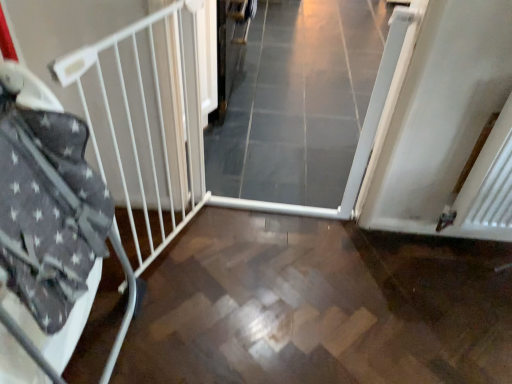
Question: Is white metal bed frame at left oriented away from wooden floor at center?

Choices:
 (A) no
 (B) yes

Answer: (A)

Question: From the image's perspective, is white metal bed frame at left below wooden floor at center?

Choices:
 (A) no
 (B) yes

Answer: (A)

Question: Does white metal bed frame at left have a lesser width compared to wooden floor at center?

Choices:
 (A) no
 (B) yes

Answer: (B)

Question: Is white metal bed frame at left positioned in front of wooden floor at center?

Choices:
 (A) yes
 (B) no

Answer: (A)

Question: From a real-world perspective, is white metal bed frame at left positioned over wooden floor at center based on gravity?

Choices:
 (A) no
 (B) yes

Answer: (B)

Question: Considering the relative sizes of white metal bed frame at left and wooden floor at center in the image provided, is white metal bed frame at left bigger than wooden floor at center?

Choices:
 (A) no
 (B) yes

Answer: (A)

Question: From the image's perspective, does white glossy door at center appear lower than wooden floor at center?

Choices:
 (A) no
 (B) yes

Answer: (A)

Question: Could you tell me if white glossy door at center is turned towards wooden floor at center?

Choices:
 (A) no
 (B) yes

Answer: (B)

Question: Is white glossy door at center bigger than wooden floor at center?

Choices:
 (A) yes
 (B) no

Answer: (A)

Question: Can you confirm if white glossy door at center is thinner than wooden floor at center?

Choices:
 (A) no
 (B) yes

Answer: (A)

Question: Is white glossy door at center further to the viewer compared to wooden floor at center?

Choices:
 (A) no
 (B) yes

Answer: (B)

Question: Is white glossy door at center turned away from wooden floor at center?

Choices:
 (A) yes
 (B) no

Answer: (B)

Question: Considering the relative sizes of white glossy door at center and white metal bed frame at left in the image provided, is white glossy door at center shorter than white metal bed frame at left?

Choices:
 (A) yes
 (B) no

Answer: (A)